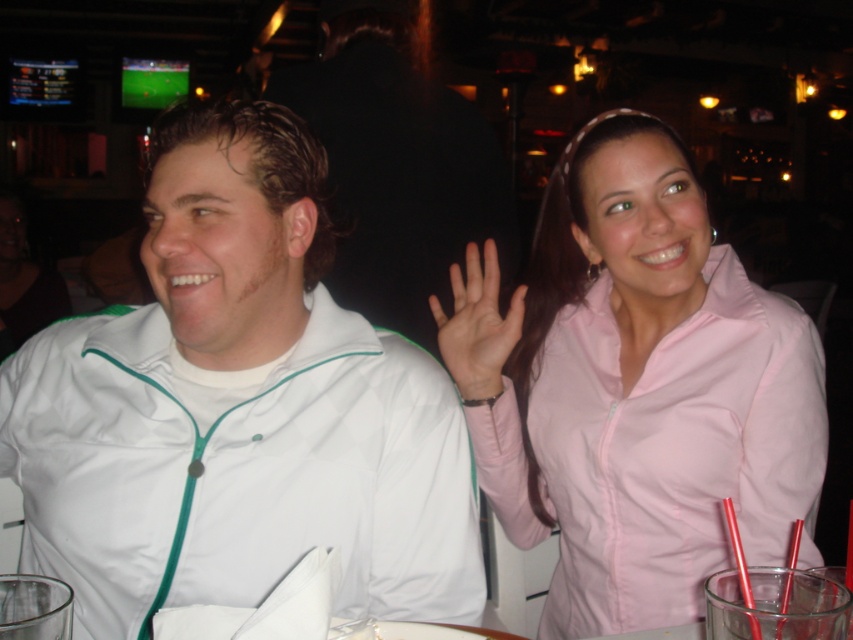
You are a photographer trying to capture a group photo of the people in the scene. The camera you are using has a sensor that can only focus on objects within a specific area defined by coordinates between 0.5 and 0.7 on the x and y axes. Given that the white matte jacket at left is located at point 0.639, 0.279, will it be in focus when you take the photo?

The white matte jacket at left is located at point (236, 408). Since the camera can focus on objects between 0.5 and 0.7 on both the x and y axes, the jacket is within the focus area on the x axis but falls below the lower y axis limit of 0.5. Therefore, it will not be in focus.